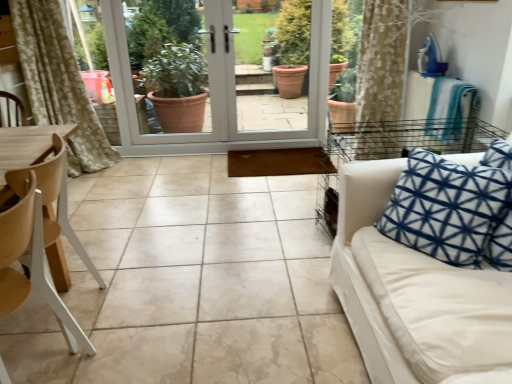
Question: Based on their positions, is white fabric couch at right located to the left or right of white glossy screen door at center?

Choices:
 (A) left
 (B) right

Answer: (B)

Question: In terms of size, does white fabric couch at right appear bigger or smaller than white glossy screen door at center?

Choices:
 (A) small
 (B) big

Answer: (B)

Question: Estimate the real-world distances between objects in this image. Which object is farther from the white fabric couch at right?

Choices:
 (A) white glossy screen door at center
 (B) white wood chair at left, the 1th chair positioned from the front
 (C) wooden at left, placed as the 1th chair when sorted from back to front

Answer: (A)

Question: Considering the real-world distances, which object is farthest from the white wood chair at left, the 2th chair from the back?

Choices:
 (A) white glossy screen door at center
 (B) wooden at left, placed as the 1th chair when sorted from back to front
 (C) white fabric couch at right

Answer: (A)